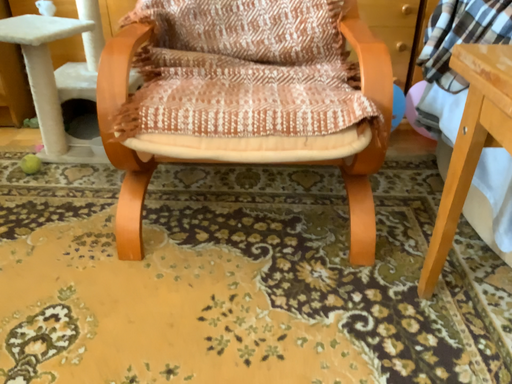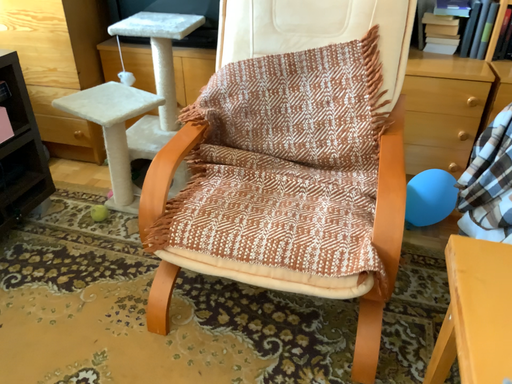
Question: Which way did the camera rotate in the video?

Choices:
 (A) rotated left
 (B) rotated right

Answer: (A)